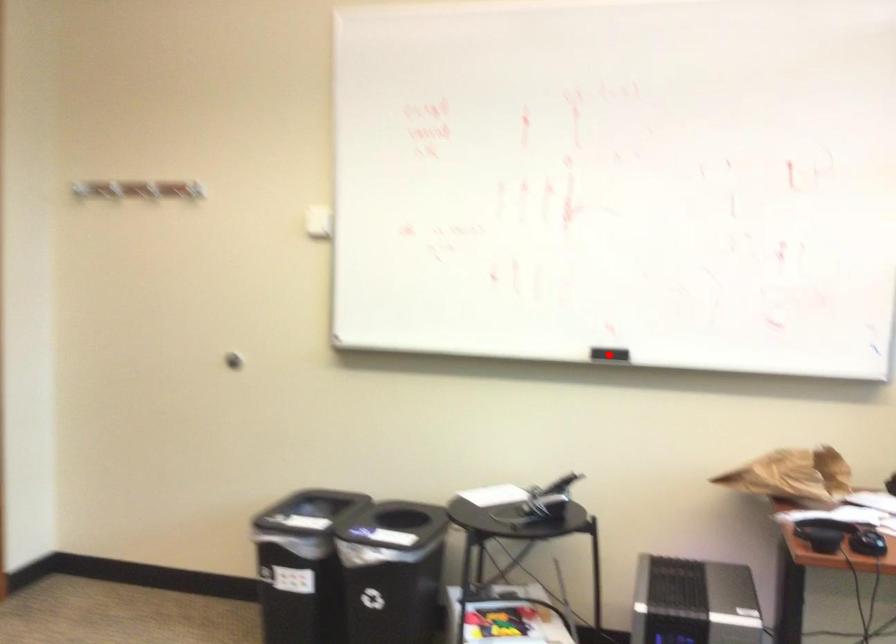
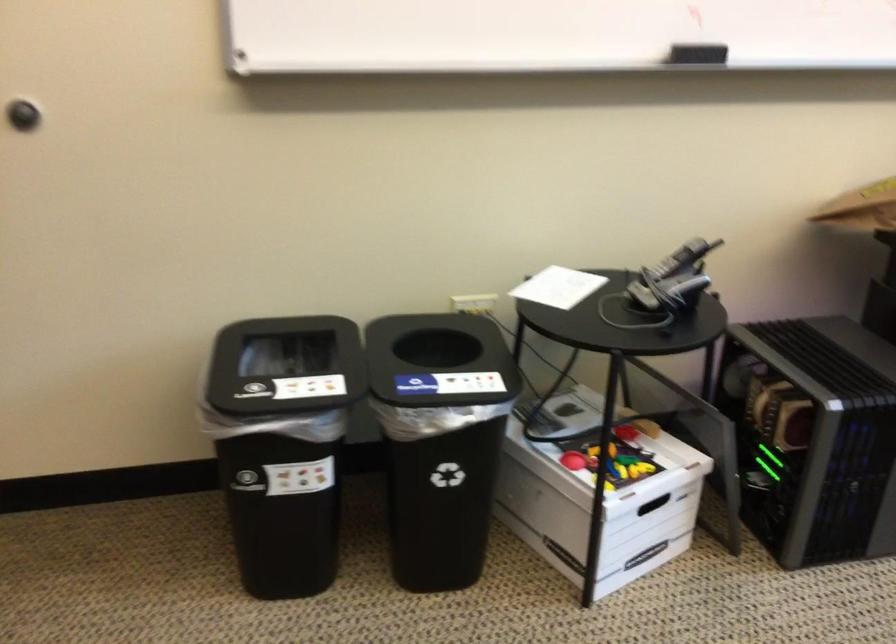
Where in the second image is the point corresponding to the highlighted location from the first image?

(696, 53)